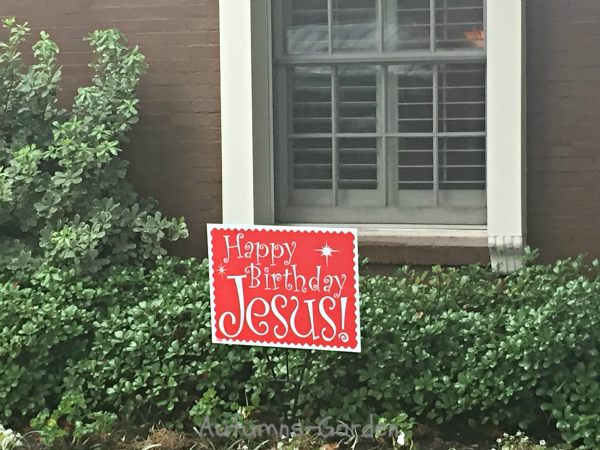
The image size is (600, 450). I want to click on stand, so click(291, 380).